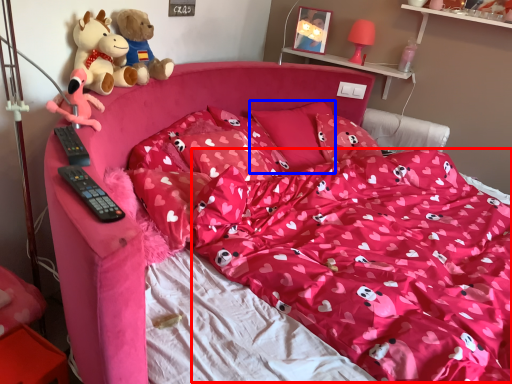
Question: Among these objects, which one is farthest to the camera, blanket (highlighted by a red box) or pillow (highlighted by a blue box)?

Choices:
 (A) blanket
 (B) pillow

Answer: (B)